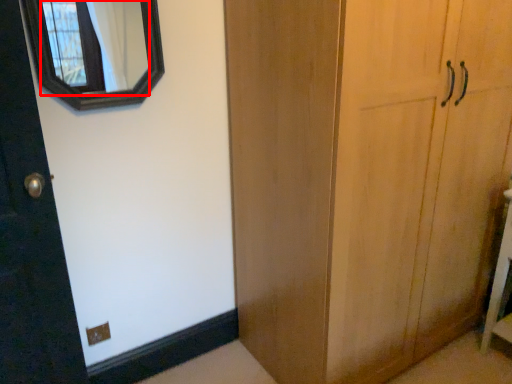
Question: From the image's perspective, where is mirror (annotated by the red box) located in relation to vanity in the image?

Choices:
 (A) below
 (B) above

Answer: (B)